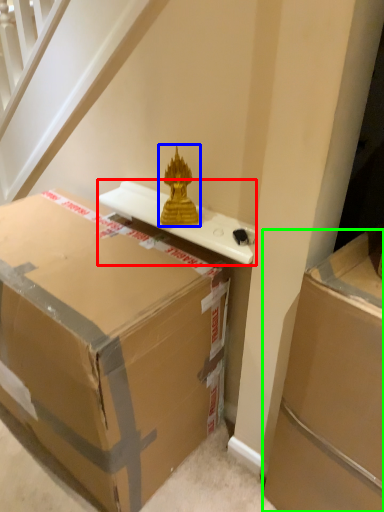
Question: Which is farther away from table (highlighted by a red box)? sculpture (highlighted by a blue box) or box (highlighted by a green box)?

Choices:
 (A) sculpture
 (B) box

Answer: (B)